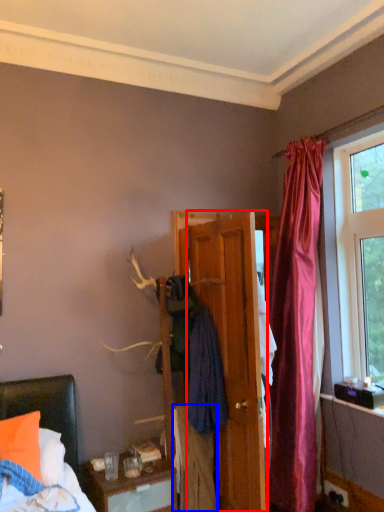
Question: Which object is further to the camera taking this photo, door (highlighted by a red box) or clothing (highlighted by a blue box)?

Choices:
 (A) door
 (B) clothing

Answer: (B)